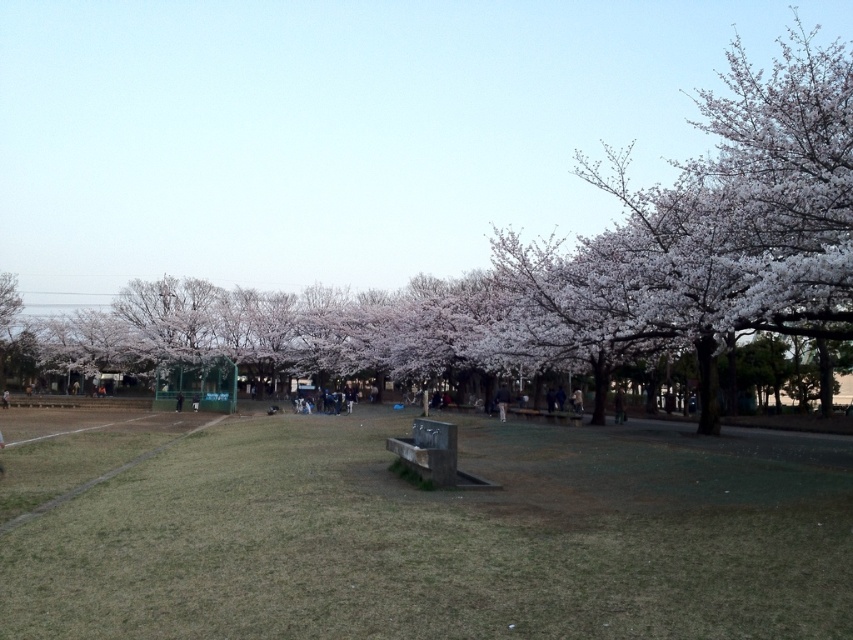
You are standing in the park and see the white blossoms at center and the dark blue jeans at center. Which object is closer to you?

The white blossoms at center are closer to you since they are further to the viewer than the dark blue jeans at center.